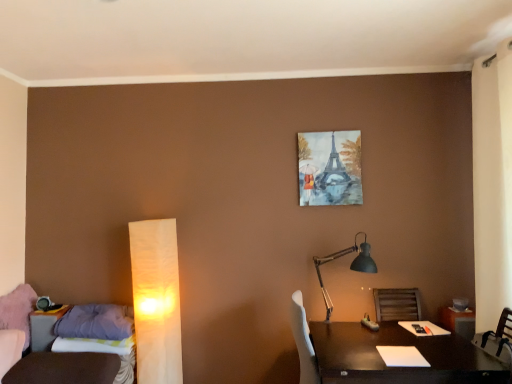
What do you see at coordinates (156, 301) in the screenshot? This screenshot has width=512, height=384. I see `white paper lamp at left, positioned as the 2th lamp in right-to-left order` at bounding box center [156, 301].

At what (x,y) coordinates should I click in order to perform the action: click on soft purple fabric at left. Please return your answer as a coordinate pair (x, y). This screenshot has width=512, height=384. Looking at the image, I should click on (93, 345).

In order to click on white paper lamp at left, positioned as the 2th lamp in right-to-left order in this screenshot , I will do `click(156, 301)`.

Does dark wood table at lower right have a larger size compared to purple fabric pillow at lower left?

Yes.

Between dark wood table at lower right and purple fabric pillow at lower left, which one has smaller width?

With smaller width is purple fabric pillow at lower left.

This screenshot has height=384, width=512. In order to click on pillow above the dark wood table at lower right (from the image's perspective) in this screenshot , I will do click(94, 322).

Is dark wood table at lower right looking in the opposite direction of purple fabric pillow at lower left?

No, dark wood table at lower right is not facing away from purple fabric pillow at lower left.

Between matte black lamp at right, marked as the second lamp in a left-to-right arrangement, and dark wood table at lower right, which one has larger width?

dark wood table at lower right.

From the image's perspective, is matte black lamp at right, the 1th lamp in the right-to-left sequence, over dark wood table at lower right?

Yes, from the image's perspective, matte black lamp at right, the 1th lamp in the right-to-left sequence, is on top of dark wood table at lower right.

How many degrees apart are the facing directions of matte black lamp at right, marked as the second lamp in a left-to-right arrangement, and dark wood table at lower right?

There is a 4.03-degree angle between the facing directions of matte black lamp at right, marked as the second lamp in a left-to-right arrangement, and dark wood table at lower right.

How far apart are matte black lamp at right, the 1th lamp in the right-to-left sequence, and dark wood table at lower right?

29.95 inches.

Is watercolor painting of eiffel tower at upper center outside of dark wood table at lower right?

Yes, watercolor painting of eiffel tower at upper center is not within dark wood table at lower right.

Who is taller, watercolor painting of eiffel tower at upper center or dark wood table at lower right?

watercolor painting of eiffel tower at upper center.

From a real-world perspective, is watercolor painting of eiffel tower at upper center physically below dark wood table at lower right?

No, from a real-world perspective, watercolor painting of eiffel tower at upper center is not under dark wood table at lower right.

Does watercolor painting of eiffel tower at upper center have a lesser width compared to dark wood table at lower right?

Indeed, watercolor painting of eiffel tower at upper center has a lesser width compared to dark wood table at lower right.

How different are the orientations of white paper lamp at left, arranged as the first lamp when viewed from the left, and matte black lamp at right, marked as the second lamp in a left-to-right arrangement, in degrees?

The angle between the facing direction of white paper lamp at left, arranged as the first lamp when viewed from the left, and the facing direction of matte black lamp at right, marked as the second lamp in a left-to-right arrangement, is 0.776 degrees.

Can you confirm if white paper lamp at left, positioned as the 2th lamp in right-to-left order, is wider than matte black lamp at right, the 1th lamp in the right-to-left sequence?

Incorrect, the width of white paper lamp at left, positioned as the 2th lamp in right-to-left order, does not surpass that of matte black lamp at right, the 1th lamp in the right-to-left sequence.

Does white paper lamp at left, positioned as the 2th lamp in right-to-left order, turn towards matte black lamp at right, marked as the second lamp in a left-to-right arrangement?

No, white paper lamp at left, positioned as the 2th lamp in right-to-left order, does not turn towards matte black lamp at right, marked as the second lamp in a left-to-right arrangement.

Is white paper lamp at left, positioned as the 2th lamp in right-to-left order, not inside matte black lamp at right, marked as the second lamp in a left-to-right arrangement?

Absolutely, white paper lamp at left, positioned as the 2th lamp in right-to-left order, is external to matte black lamp at right, marked as the second lamp in a left-to-right arrangement.

Which of these two, soft purple fabric at left or purple fabric pillow at lower left, is bigger?

Bigger between the two is purple fabric pillow at lower left.

Is soft purple fabric at left positioned far away from purple fabric pillow at lower left?

No, there isn't a large distance between soft purple fabric at left and purple fabric pillow at lower left.

Considering the points (53, 347) and (58, 326), which point is behind, point (53, 347) or point (58, 326)?

The point (58, 326) is farther from the camera.

Could you tell me if dark wood table at lower right is turned towards white paper lamp at left, positioned as the 2th lamp in right-to-left order?

No, dark wood table at lower right does not turn towards white paper lamp at left, positioned as the 2th lamp in right-to-left order.

Is dark wood table at lower right positioned behind white paper lamp at left, positioned as the 2th lamp in right-to-left order?

No, dark wood table at lower right is closer to the camera.

Considering the positions of point (460, 353) and point (161, 263), is point (460, 353) closer or farther from the camera than point (161, 263)?

Point (460, 353) appears to be closer to the viewer than point (161, 263).

Does matte black lamp at right, the 1th lamp in the right-to-left sequence, lie in front of soft purple fabric at left?

Yes.

Considering the sizes of matte black lamp at right, marked as the second lamp in a left-to-right arrangement, and soft purple fabric at left in the image, is matte black lamp at right, marked as the second lamp in a left-to-right arrangement, wider or thinner than soft purple fabric at left?

Clearly, matte black lamp at right, marked as the second lamp in a left-to-right arrangement, has more width compared to soft purple fabric at left.

Who is shorter, matte black lamp at right, marked as the second lamp in a left-to-right arrangement, or soft purple fabric at left?

Standing shorter between the two is soft purple fabric at left.

Find the location of `sheet on the left of matte black lamp at right, the 1th lamp in the right-to-left sequence`. sheet on the left of matte black lamp at right, the 1th lamp in the right-to-left sequence is located at coordinates (93, 345).

Where is `pillow that is behind the dark wood table at lower right`? The width and height of the screenshot is (512, 384). pillow that is behind the dark wood table at lower right is located at coordinates (94, 322).

Where is `table that is on the right side of matte black lamp at right, marked as the second lamp in a left-to-right arrangement`? This screenshot has height=384, width=512. table that is on the right side of matte black lamp at right, marked as the second lamp in a left-to-right arrangement is located at coordinates (398, 367).

Estimate the real-world distances between objects in this image. Which object is further from white paper lamp at left, positioned as the 2th lamp in right-to-left order, purple fabric pillow at lower left or soft purple fabric at left?

Among the two, soft purple fabric at left is located further to white paper lamp at left, positioned as the 2th lamp in right-to-left order.

Considering their positions, is white paper lamp at left, positioned as the 2th lamp in right-to-left order, positioned further to watercolor painting of eiffel tower at upper center than dark wood table at lower right?

Among the two, white paper lamp at left, positioned as the 2th lamp in right-to-left order, is located further to watercolor painting of eiffel tower at upper center.

Estimate the real-world distances between objects in this image. Which object is closer to dark wood table at lower right, purple fabric pillow at lower left or watercolor painting of eiffel tower at upper center?

watercolor painting of eiffel tower at upper center.

When comparing their distances from white paper lamp at left, arranged as the first lamp when viewed from the left, does dark wood table at lower right or watercolor painting of eiffel tower at upper center seem further?

The object further to white paper lamp at left, arranged as the first lamp when viewed from the left, is dark wood table at lower right.

Considering their positions, is matte black lamp at right, marked as the second lamp in a left-to-right arrangement, positioned further to purple fabric pillow at lower left than dark wood table at lower right?

dark wood table at lower right lies further to purple fabric pillow at lower left than the other object.

Estimate the real-world distances between objects in this image. Which object is closer to matte black lamp at right, marked as the second lamp in a left-to-right arrangement, dark wood table at lower right or purple fabric pillow at lower left?

The object closer to matte black lamp at right, marked as the second lamp in a left-to-right arrangement, is dark wood table at lower right.

Estimate the real-world distances between objects in this image. Which object is further from matte black lamp at right, marked as the second lamp in a left-to-right arrangement, watercolor painting of eiffel tower at upper center or white paper lamp at left, arranged as the first lamp when viewed from the left?

white paper lamp at left, arranged as the first lamp when viewed from the left, is positioned further to the anchor matte black lamp at right, marked as the second lamp in a left-to-right arrangement.

In the scene shown: From the image, which object appears to be farther from purple fabric pillow at lower left, watercolor painting of eiffel tower at upper center or white paper lamp at left, arranged as the first lamp when viewed from the left?

watercolor painting of eiffel tower at upper center is positioned further to the anchor purple fabric pillow at lower left.

You are a GUI agent. You are given a task and a screenshot of the screen. Output one action in this format:
    pyautogui.click(x=<x>, y=<y>)
    Task: Click on the picture frame between soft purple fabric at left and matte black lamp at right, the 1th lamp in the right-to-left sequence
    
    Given the screenshot: What is the action you would take?
    pyautogui.click(x=330, y=168)

At what (x,y) coordinates should I click in order to perform the action: click on pillow between soft purple fabric at left and matte black lamp at right, the 1th lamp in the right-to-left sequence, from left to right. Please return your answer as a coordinate pair (x, y). The width and height of the screenshot is (512, 384). Looking at the image, I should click on [94, 322].

This screenshot has width=512, height=384. I want to click on picture frame between purple fabric pillow at lower left and matte black lamp at right, the 1th lamp in the right-to-left sequence, so click(x=330, y=168).

Find the location of a particular element. This screenshot has width=512, height=384. pillow between soft purple fabric at left and watercolor painting of eiffel tower at upper center from left to right is located at coordinates (94, 322).